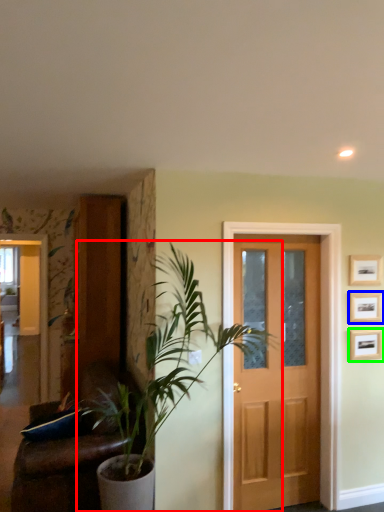
Question: Which object is positioned farthest from houseplant (highlighted by a red box)? Select from picture frame (highlighted by a blue box) and picture frame (highlighted by a green box).

Choices:
 (A) picture frame
 (B) picture frame

Answer: (A)